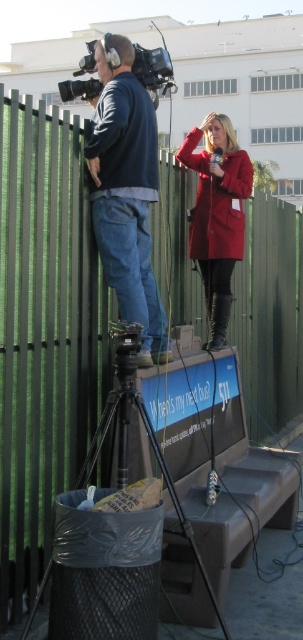
Is point (153, 516) behind point (107, 45)?

No, it is in front of (107, 45).

Looking at this image, between black plastic tripod at lower center and matte black video camera at upper left, which one is positioned lower?

black plastic tripod at lower center

The width and height of the screenshot is (303, 640). Identify the location of black plastic tripod at lower center. (113, 532).

Can you confirm if blue denim jeans at center is thinner than matte black video camera at upper left?

Yes, blue denim jeans at center is thinner than matte black video camera at upper left.

Is point (130, 49) farther from camera compared to point (77, 90)?

That is False.

At what (x,y) coordinates should I click in order to perform the action: click on blue denim jeans at center. Please return your answer as a coordinate pair (x, y). This screenshot has height=640, width=303. Looking at the image, I should click on (126, 192).

In order to click on blue denim jeans at center in this screenshot , I will do `click(126, 192)`.

Does blue denim jeans at center have a lesser width compared to matte red coat at center?

Yes, blue denim jeans at center is thinner than matte red coat at center.

Where is `blue denim jeans at center`? blue denim jeans at center is located at coordinates (126, 192).

Where is `blue denim jeans at center`? This screenshot has height=640, width=303. blue denim jeans at center is located at coordinates (126, 192).